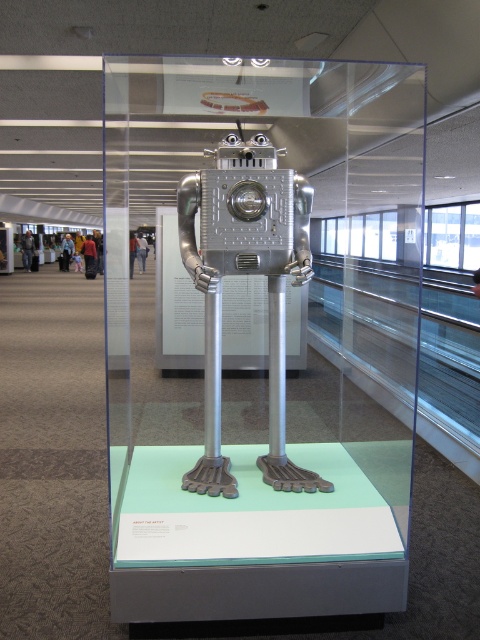
Which is more to the left, transparent glass robot at center or metallic robot at center?

transparent glass robot at center

Between transparent glass robot at center and metallic robot at center, which one is positioned lower?

metallic robot at center is lower down.

Who is more distant from viewer, (389,531) or (216,474)?

Point (216,474)

This screenshot has width=480, height=640. Identify the location of transparent glass robot at center. (263, 339).